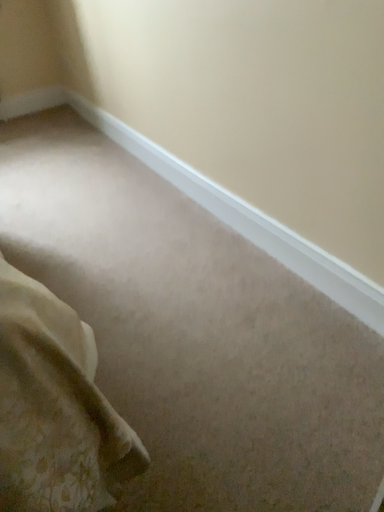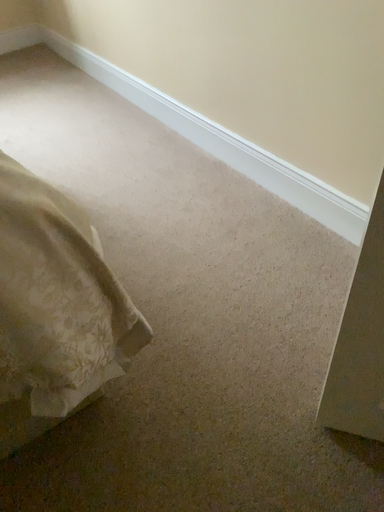
Question: How did the camera likely rotate when shooting the video?

Choices:
 (A) rotated downward
 (B) rotated upward

Answer: (A)